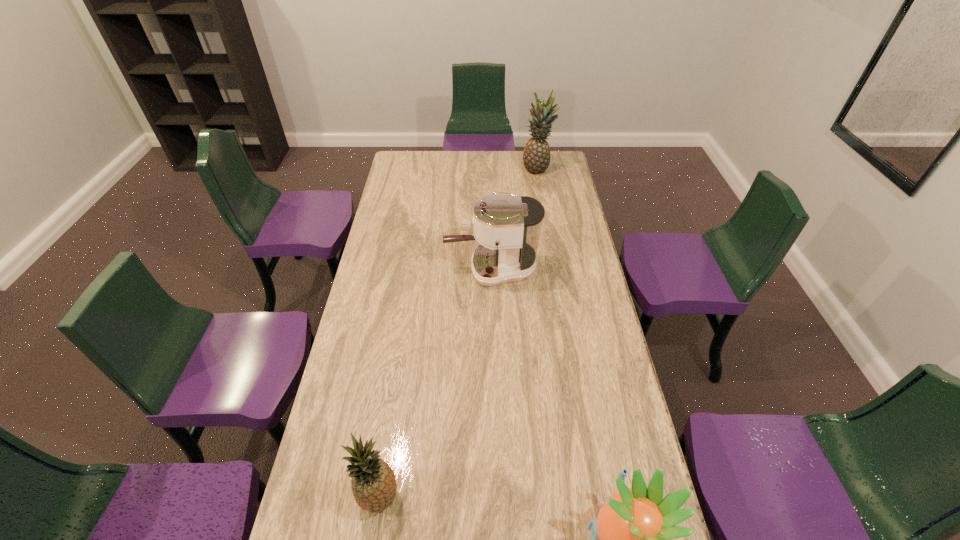
Find the location of a particular element. The image size is (960, 540). object that is at the left edge is located at coordinates (374, 487).

The image size is (960, 540). Identify the location of object at the right edge. (x=536, y=156).

Identify the location of object that is at the far right corner. Image resolution: width=960 pixels, height=540 pixels. (536, 156).

Where is `vacant area at the far edge of the desktop`? The image size is (960, 540). vacant area at the far edge of the desktop is located at coordinates (432, 153).

You are a GUI agent. You are given a task and a screenshot of the screen. Output one action in this format:
    pyautogui.click(x=<x>, y=<y>)
    Task: Click on the vacant space at the left edge
    This screenshot has height=540, width=960.
    Given the screenshot: What is the action you would take?
    pyautogui.click(x=404, y=239)

Image resolution: width=960 pixels, height=540 pixels. In the image, there is a desktop. What are the coordinates of `vacant space at the right edge` in the screenshot? It's located at (614, 484).

At what (x,y) coordinates should I click in order to perform the action: click on blank region between the leftmost object and the farthest pineapple. Please return your answer as a coordinate pair (x, y). The height and width of the screenshot is (540, 960). Looking at the image, I should click on (458, 333).

This screenshot has height=540, width=960. I want to click on free space between the tallest object and the leftmost object, so click(458, 333).

Image resolution: width=960 pixels, height=540 pixels. Identify the location of free point between the leftmost pineapple and the coffee maker. (435, 383).

Find the location of `free space between the coffee maker and the leftmost pineapple`. free space between the coffee maker and the leftmost pineapple is located at coordinates (435, 383).